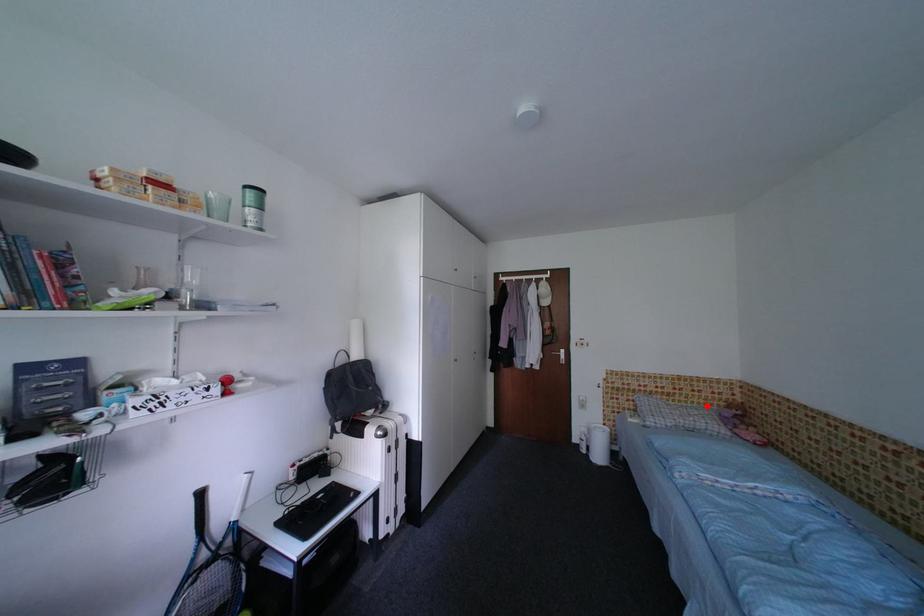
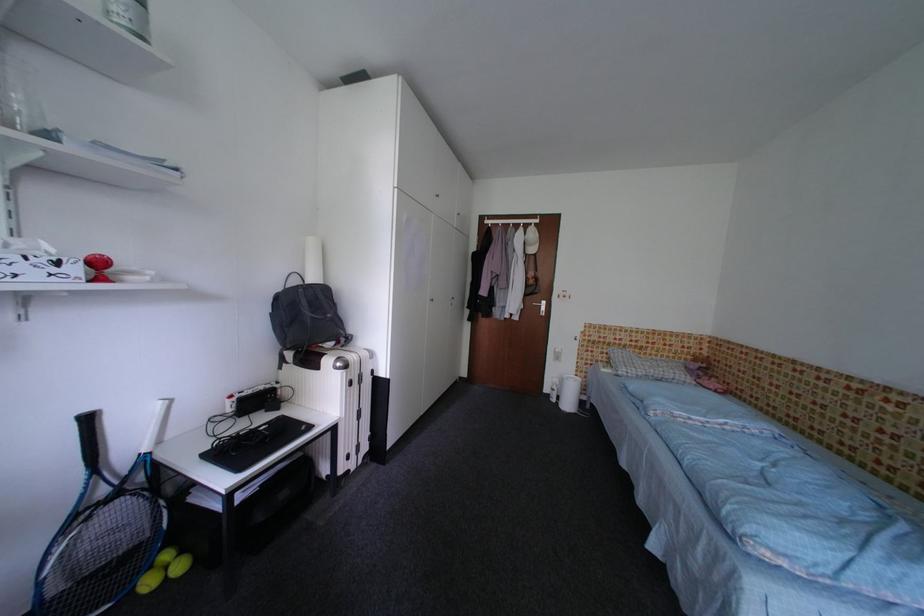
Find the pixel in the second image that matches the highlighted location in the first image.

(675, 360)